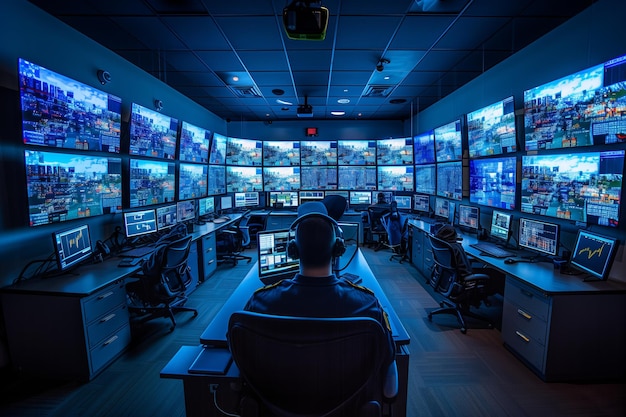
Identify the location of chairs. The image size is (626, 417). (290, 361), (454, 281), (399, 240), (372, 222), (340, 202), (309, 208), (265, 217), (245, 223), (168, 293).